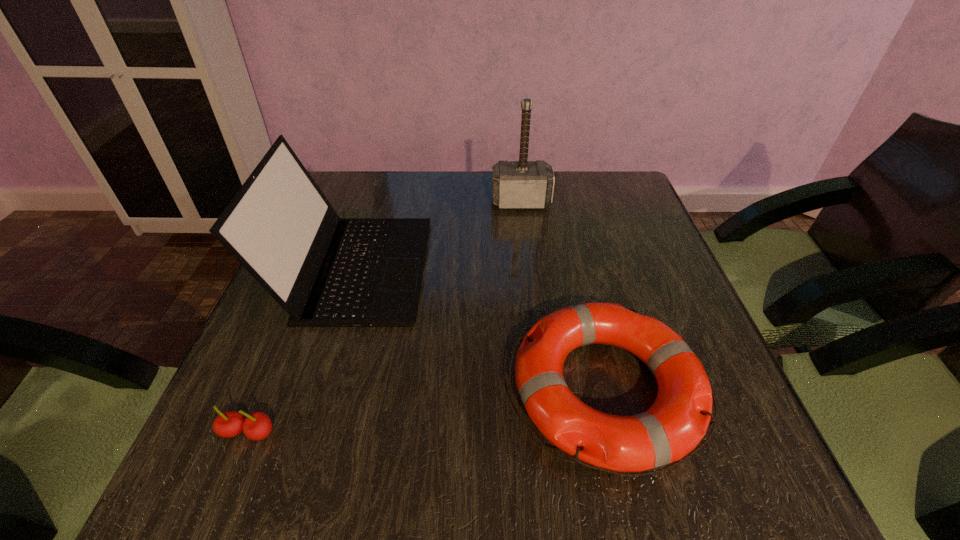
This screenshot has width=960, height=540. What are the coordinates of `hammer` in the screenshot? It's located at (522, 184).

The height and width of the screenshot is (540, 960). In order to click on laptop in this screenshot , I will do (x=325, y=271).

Locate an element on the screen. Image resolution: width=960 pixels, height=540 pixels. life buoy is located at coordinates (673, 426).

I want to click on cherry, so click(256, 426).

This screenshot has height=540, width=960. Identify the location of vacant space located for striking with the head of the farthest object. (527, 251).

What are the coordinates of `vacant space situated on the surface of the laptop` in the screenshot? It's located at tap(530, 268).

Where is `blank area located 0.230m on the left of the life buoy`? This screenshot has width=960, height=540. blank area located 0.230m on the left of the life buoy is located at coordinates (377, 390).

The image size is (960, 540). I want to click on vacant region located 0.320m on the back of the cherry, so click(x=307, y=286).

Find the location of `object at the far edge`. object at the far edge is located at coordinates (522, 184).

You are a GUI agent. You are given a task and a screenshot of the screen. Output one action in this format:
    pyautogui.click(x=<x>, y=<y>)
    Task: Click on the life buoy that is positioned at the near edge
    The image size is (960, 540).
    Given the screenshot: What is the action you would take?
    pyautogui.click(x=673, y=426)